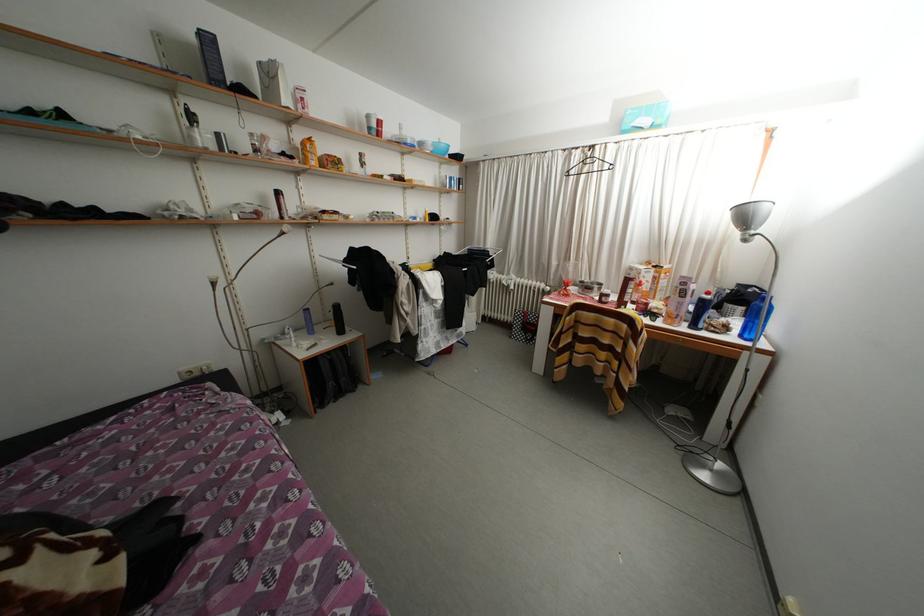
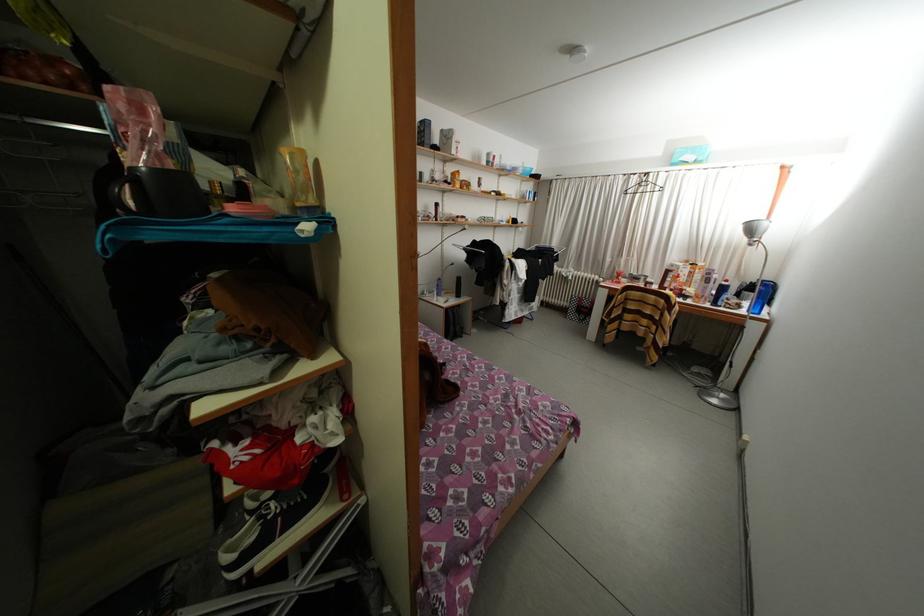
Where in the second image is the point corresponding to point 735,333 from the first image?

(747, 310)